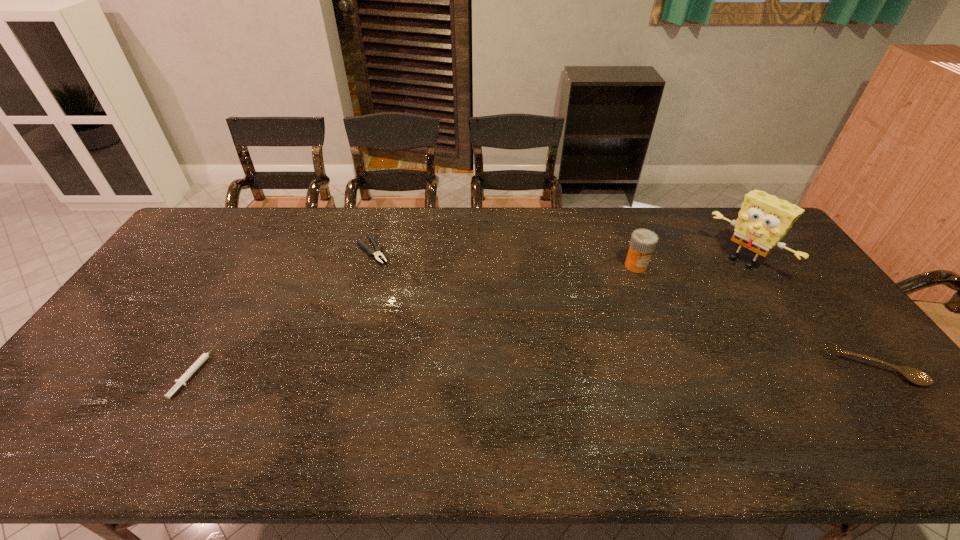
The height and width of the screenshot is (540, 960). What are the coordinates of `ladle that is at the near edge` in the screenshot? It's located at (913, 375).

The height and width of the screenshot is (540, 960). Identify the location of ladle that is at the right edge. (913, 375).

You are a GUI agent. You are given a task and a screenshot of the screen. Output one action in this format:
    pyautogui.click(x=<x>, y=<y>)
    Task: Click on the sponge that is positioned at the right edge
    This screenshot has width=960, height=540.
    Given the screenshot: What is the action you would take?
    pyautogui.click(x=764, y=219)

Find the location of a particular element. The image size is (960, 540). object that is at the far right corner is located at coordinates (764, 219).

At what (x,y) coordinates should I click in order to perform the action: click on object that is at the near right corner. Please return your answer as a coordinate pair (x, y). The image size is (960, 540). Looking at the image, I should click on (913, 375).

In the image, there is a desktop. What are the coordinates of `vacant space at the far edge` in the screenshot? It's located at pyautogui.click(x=405, y=218).

The width and height of the screenshot is (960, 540). In the image, there is a desktop. Identify the location of vacant space at the near edge. (419, 389).

Locate an element on the screen. free spot at the right edge of the desktop is located at coordinates (850, 368).

Locate an element on the screen. This screenshot has width=960, height=540. vacant space at the far left corner of the desktop is located at coordinates (214, 217).

Find the location of a particular element. The width and height of the screenshot is (960, 540). vacant space that is in between the third tallest object and the leftmost object is located at coordinates (534, 369).